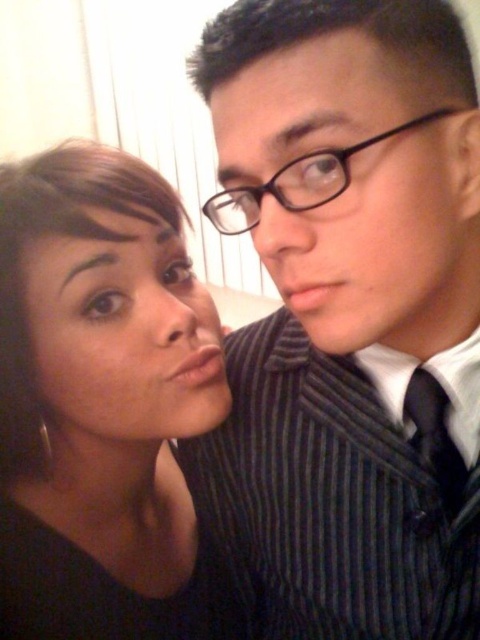
You are taking a photo of two people standing in front of you. The first person is at point [265,161] and the second is at point [70,513]. Which person is closer to your camera?

The person at point [265,161] is closer to the camera than the person at point [70,513].

You are a photographer trying to capture a closeup shot of the striped fabric suit at center and the matte black hair at left. Your camera can only focus on objects within a 5 inch range. Will both subjects be in focus?

The distance between the striped fabric suit at center and the matte black hair at left is 4.95 inches, which is within the 5 inch range. Therefore, both subjects will be in focus.

What is the exact coordinate of the striped fabric suit at center?

Answer: The striped fabric suit at center is located at coordinate point (347, 321).